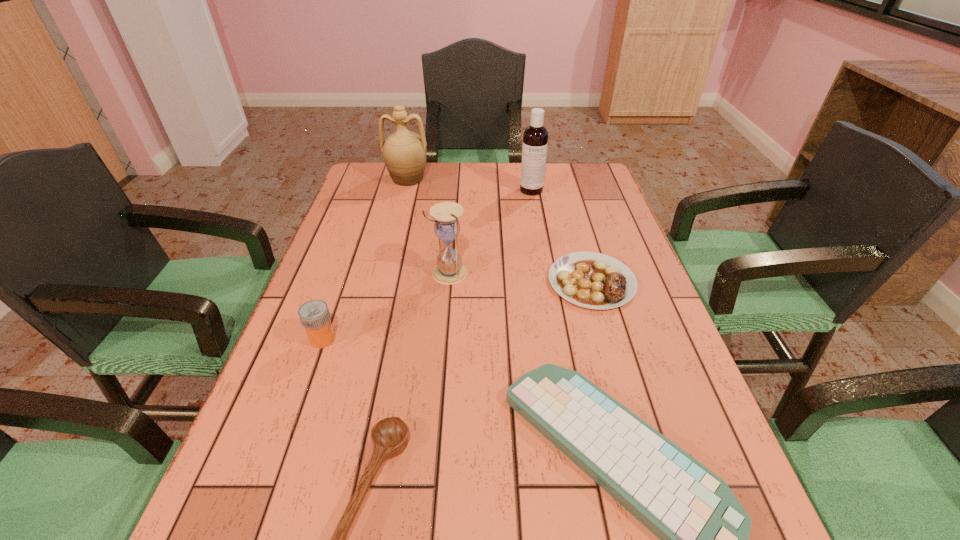
Identify the location of free space located 0.360m on the back of the steak. (564, 188).

Find the location of `dishwasher detergent at the far edge`. dishwasher detergent at the far edge is located at coordinates (535, 138).

Locate an element on the screen. The height and width of the screenshot is (540, 960). pitcher that is positioned at the far edge is located at coordinates (404, 152).

What are the coordinates of `pitcher present at the left edge` in the screenshot? It's located at (404, 152).

Find the location of `medicine at the left edge`. medicine at the left edge is located at coordinates (314, 315).

Where is `object that is at the right edge`? object that is at the right edge is located at coordinates (592, 280).

In order to click on object present at the far left corner in this screenshot , I will do `click(404, 152)`.

The height and width of the screenshot is (540, 960). I want to click on vacant space at the far edge of the desktop, so click(426, 190).

The image size is (960, 540). What are the coordinates of `free region at the left edge of the desktop` in the screenshot? It's located at (326, 301).

At what (x,y) coordinates should I click in order to perform the action: click on vacant space at the right edge of the desktop. Please return your answer as a coordinate pair (x, y). Image resolution: width=960 pixels, height=540 pixels. Looking at the image, I should click on (612, 321).